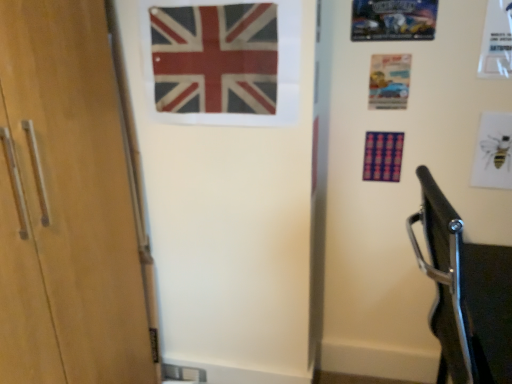
Question: From a real-world perspective, is matte paper postcard at upper right, the 2th postcard in the left-to-right sequence, located beneath metallic silver car at upper right, acting as the first postcard starting from the left?

Choices:
 (A) no
 (B) yes

Answer: (B)

Question: Is metallic silver car at upper right, acting as the first postcard starting from the left, at the back of matte paper postcard at upper right, which ranks as the second postcard in bottom-to-top order?

Choices:
 (A) yes
 (B) no

Answer: (B)

Question: From a real-world perspective, is matte paper postcard at upper right, acting as the second postcard starting from the top, physically above metallic silver car at upper right, the 1th postcard in the top-to-bottom sequence?

Choices:
 (A) no
 (B) yes

Answer: (A)

Question: Does matte paper postcard at upper right, which appears as the second postcard when viewed from the right, contain metallic silver car at upper right, which is counted as the third postcard, starting from the bottom?

Choices:
 (A) yes
 (B) no

Answer: (B)

Question: Can you confirm if matte paper postcard at upper right, which ranks as the second postcard in bottom-to-top order, is smaller than metallic silver car at upper right, acting as the first postcard starting from the left?

Choices:
 (A) yes
 (B) no

Answer: (A)

Question: Is metallic silver car at upper right, the 1th postcard in the top-to-bottom sequence, wider or thinner than matte paper postcard at upper right, acting as the second postcard starting from the top?

Choices:
 (A) wide
 (B) thin

Answer: (A)

Question: From a real-world perspective, relative to matte paper postcard at upper right, which appears as the second postcard when viewed from the right, is metallic silver car at upper right, the 1th postcard in the top-to-bottom sequence, vertically above or below?

Choices:
 (A) above
 (B) below

Answer: (A)

Question: Choose the correct answer: Is metallic silver car at upper right, the 1th postcard in the top-to-bottom sequence, inside matte paper postcard at upper right, which appears as the second postcard when viewed from the right, or outside it?

Choices:
 (A) outside
 (B) inside

Answer: (A)

Question: Considering the positions of metallic silver car at upper right, acting as the first postcard starting from the left, and matte paper postcard at upper right, which appears as the second postcard when viewed from the right, in the image, is metallic silver car at upper right, acting as the first postcard starting from the left, taller or shorter than matte paper postcard at upper right, which appears as the second postcard when viewed from the right,?

Choices:
 (A) short
 (B) tall

Answer: (A)

Question: Is matte paper postcard at upper right, which ranks as the second postcard in bottom-to-top order, to the left or to the right of red and white fabric flag at upper center in the image?

Choices:
 (A) left
 (B) right

Answer: (B)

Question: Considering the positions of matte paper postcard at upper right, which appears as the second postcard when viewed from the right, and red and white fabric flag at upper center in the image, is matte paper postcard at upper right, which appears as the second postcard when viewed from the right, taller or shorter than red and white fabric flag at upper center?

Choices:
 (A) short
 (B) tall

Answer: (A)

Question: Is point (387, 92) positioned closer to the camera than point (223, 109)?

Choices:
 (A) closer
 (B) farther

Answer: (B)

Question: Looking at the image, does matte paper postcard at upper right, the 2th postcard in the left-to-right sequence, seem bigger or smaller compared to red and white fabric flag at upper center?

Choices:
 (A) small
 (B) big

Answer: (A)

Question: Is metallic silver car at upper right, which is the 3th postcard from right to left, in front of or behind white paper bee at upper right, the third postcard viewed from the top, in the image?

Choices:
 (A) behind
 (B) front

Answer: (B)

Question: From the image's perspective, relative to white paper bee at upper right, acting as the 3th postcard starting from the left, is metallic silver car at upper right, acting as the first postcard starting from the left, above or below?

Choices:
 (A) below
 (B) above

Answer: (B)